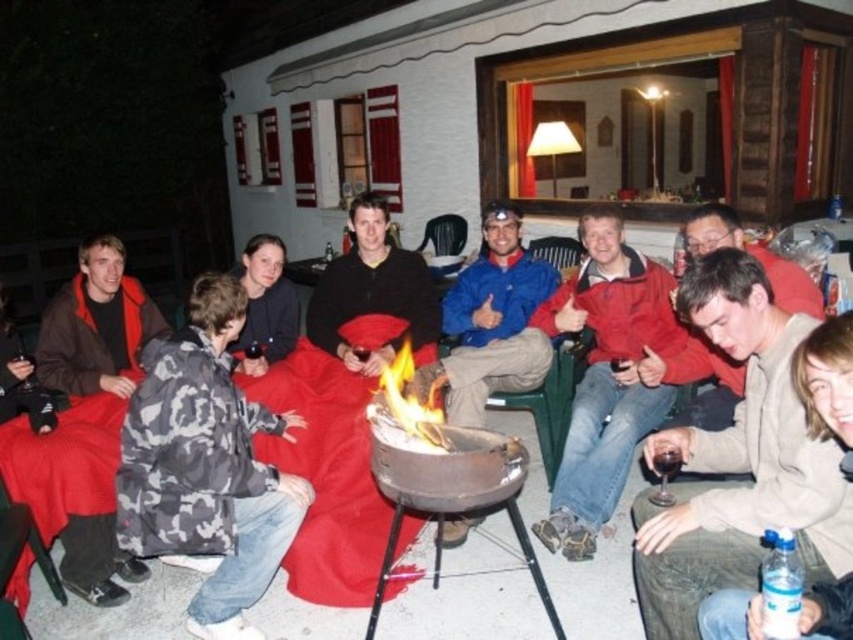
Question: Which of the following is the farthest from the observer?

Choices:
 (A) red matte jacket at center
 (B) matte black jacket at center
 (C) camouflage jacket at center

Answer: (B)

Question: Does brown fleece jacket at left lie in front of matte black jacket at center?

Choices:
 (A) yes
 (B) no

Answer: (A)

Question: Is camouflage jacket at center further to the viewer compared to matte black jacket at center?

Choices:
 (A) yes
 (B) no

Answer: (B)

Question: Which of the following is the farthest from the observer?

Choices:
 (A) (120, 300)
 (B) (419, 326)
 (C) (183, 461)
 (D) (757, 474)

Answer: (B)

Question: Among these objects, which one is nearest to the camera?

Choices:
 (A) red matte jacket at center
 (B) brown fleece jacket at left
 (C) camouflage jacket at center
 (D) light brown leather jacket at lower right

Answer: (D)

Question: Does light brown leather jacket at lower right have a larger size compared to camouflage jacket at center?

Choices:
 (A) no
 (B) yes

Answer: (A)